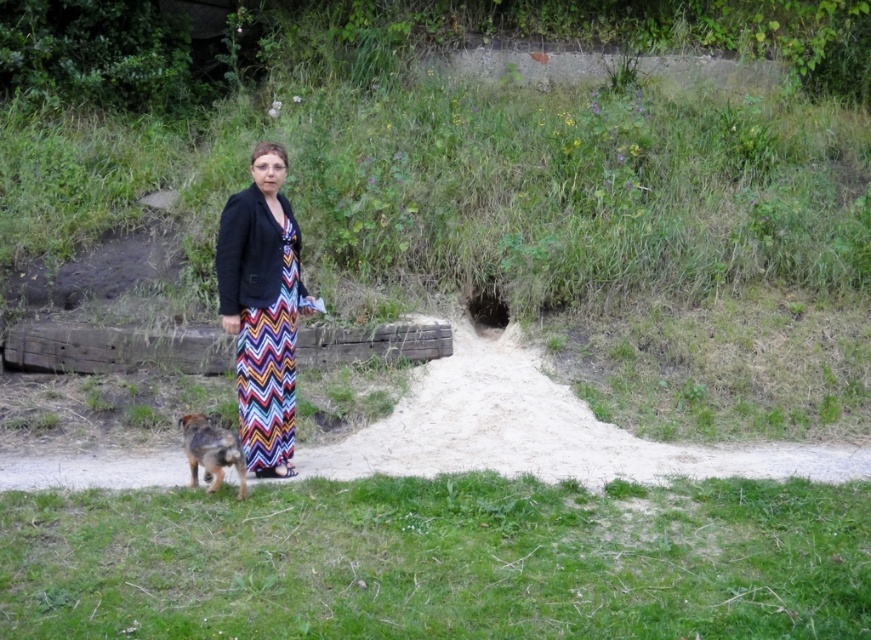
Does green grassy hillside at center have a smaller size compared to sandy dirt path at center?

Incorrect, green grassy hillside at center is not smaller in size than sandy dirt path at center.

At what (x,y) coordinates should I click in order to perform the action: click on green grassy hillside at center. Please return your answer as a coordinate pair (x, y). Looking at the image, I should click on (485, 193).

Is point (469, 278) positioned in front of point (44, 470)?

That is False.

You are a GUI agent. You are given a task and a screenshot of the screen. Output one action in this format:
    pyautogui.click(x=<x>, y=<y>)
    Task: Click on the green grassy hillside at center
    The image size is (871, 640).
    Given the screenshot: What is the action you would take?
    pyautogui.click(x=485, y=193)

Measure the distance between sandy dirt path at center and mixed-pattern fabric dress at center.

sandy dirt path at center is 38.57 inches from mixed-pattern fabric dress at center.

Does sandy dirt path at center appear under mixed-pattern fabric dress at center?

Yes.

Is point (844, 460) farther from camera compared to point (294, 234)?

Yes, it is.

This screenshot has width=871, height=640. Find the location of `sandy dirt path at center`. sandy dirt path at center is located at coordinates (539, 429).

Describe the element at coordinates (269, 371) in the screenshot. The width and height of the screenshot is (871, 640). I see `mixed-pattern fabric dress at center` at that location.

Does mixed-pattern fabric dress at center appear over brown fur dog at lower left?

Yes, mixed-pattern fabric dress at center is above brown fur dog at lower left.

Identify the location of mixed-pattern fabric dress at center. The height and width of the screenshot is (640, 871). (269, 371).

Identify the location of mixed-pattern fabric dress at center. (269, 371).